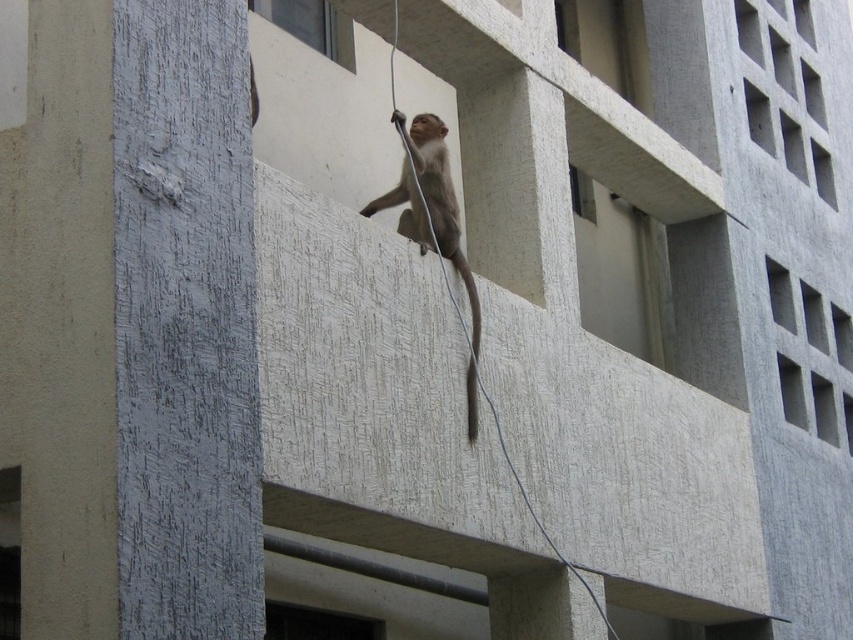
Question: Is fuzzy gray monkey at center thinner than brown fur tail at center?

Choices:
 (A) no
 (B) yes

Answer: (A)

Question: Does fuzzy gray monkey at center have a larger size compared to brown fur tail at center?

Choices:
 (A) no
 (B) yes

Answer: (B)

Question: In this image, where is fuzzy gray monkey at center located relative to brown fur tail at center?

Choices:
 (A) below
 (B) above

Answer: (B)

Question: Which point is farther to the camera?

Choices:
 (A) fuzzy gray monkey at center
 (B) brown fur tail at center

Answer: (A)

Question: Which point appears closest to the camera in this image?

Choices:
 (A) (474, 349)
 (B) (424, 173)

Answer: (A)